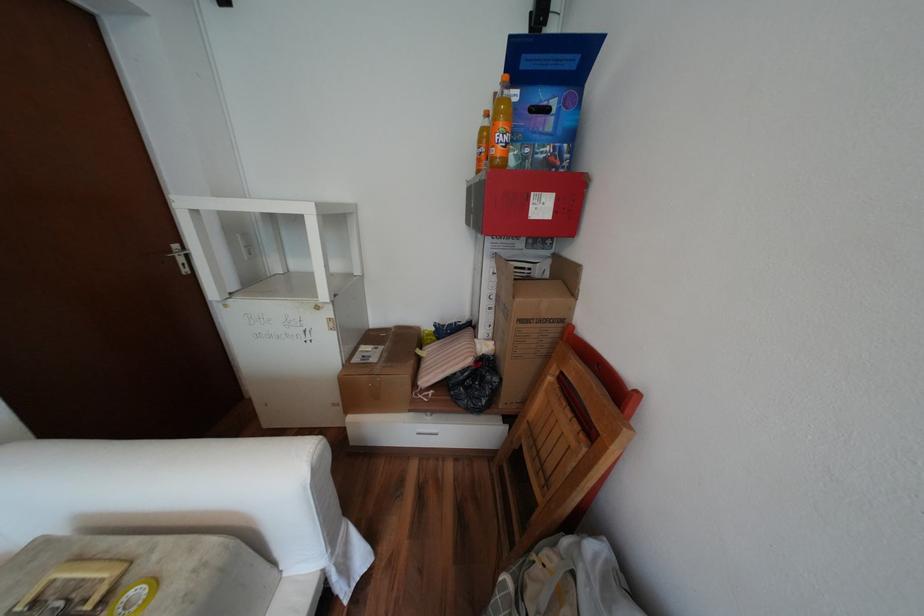
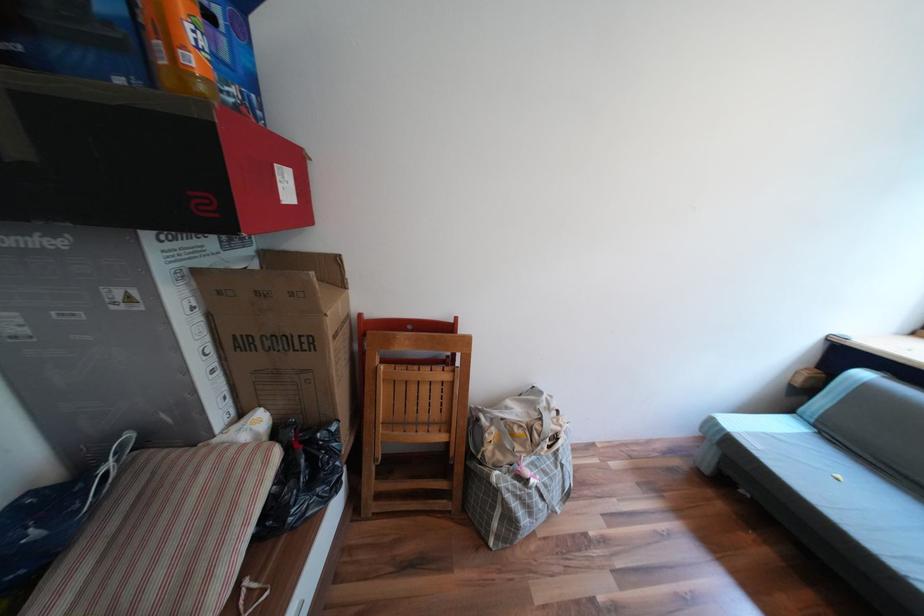
Based on the continuous images, in which direction is the camera rotating?

The camera's rotation is toward right-down.